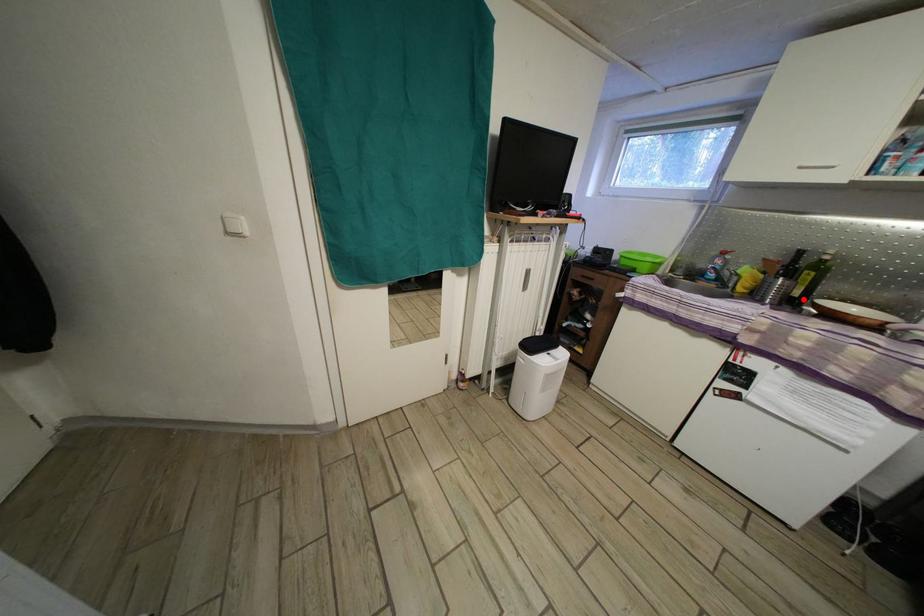
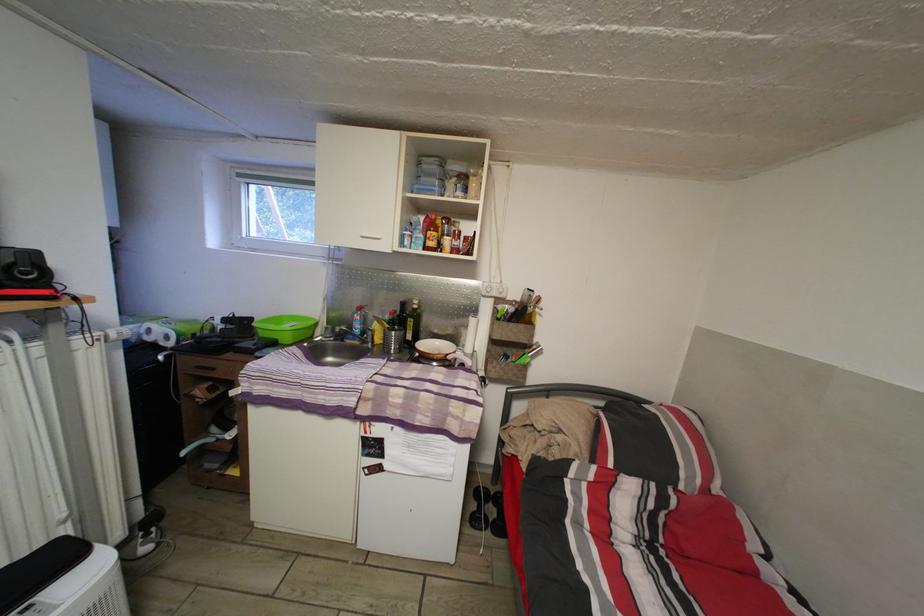
In the second image, find the point that corresponds to the highlighted location in the first image.

(417, 344)